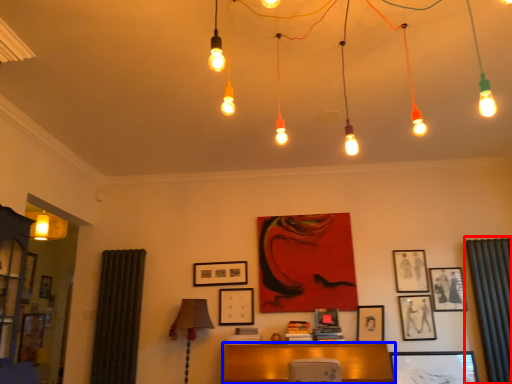
Question: Which of the following is the farthest to the observer, curtain (highlighted by a red box) or furniture (highlighted by a blue box)?

Choices:
 (A) curtain
 (B) furniture

Answer: (A)